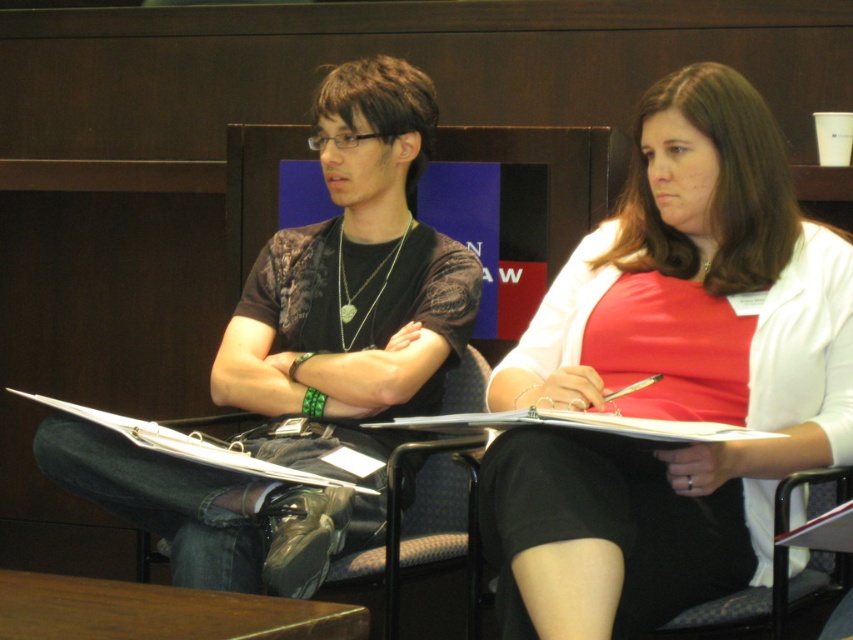
Between matte white blouse at center and brown wood table at lower left, which one has more height?

matte white blouse at center is taller.

Consider the image. Between matte white blouse at center and brown wood table at lower left, which one is positioned higher?

matte white blouse at center is higher up.

Who is more distant from viewer, [677,76] or [338,612]?

The point [677,76] is more distant.

Identify the location of matte white blouse at center. (671, 378).

Between point (720, 628) and point (196, 435), which one is positioned in front?

Positioned in front is point (720, 628).

The height and width of the screenshot is (640, 853). I want to click on fabric covered chair at lower right, so click(x=764, y=600).

Locate an element on the screen. Image resolution: width=853 pixels, height=640 pixels. black matte shirt at center is located at coordinates (352, 282).

Who is higher up, black matte shirt at center or fabric covered chair at lower right?

Positioned higher is black matte shirt at center.

Which is behind, point (252, 404) or point (666, 636)?

Positioned behind is point (252, 404).

This screenshot has width=853, height=640. Find the location of `black matte shirt at center`. black matte shirt at center is located at coordinates (352, 282).